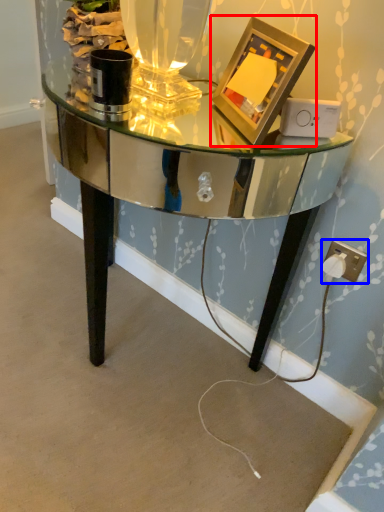
Question: Which of the following is the farthest to the observer, picture frame (highlighted by a red box) or electric outlet (highlighted by a blue box)?

Choices:
 (A) picture frame
 (B) electric outlet

Answer: (B)